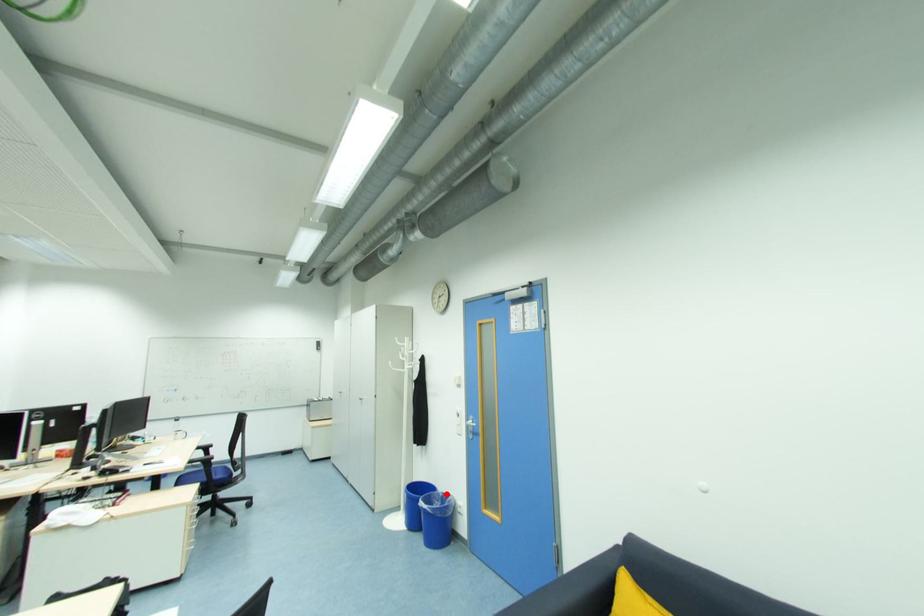
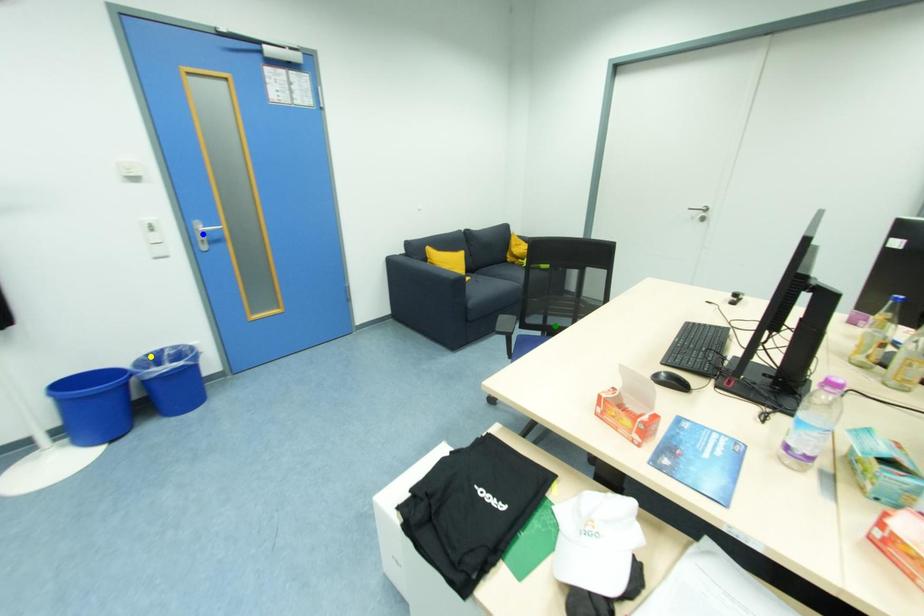
Question: I am providing you with two images of the same scene from different viewpoints. A red point is marked on the first image. You are given multiple points on the second image. Which point in image 2 is actually the same real-world point as the red point in image 1?

Choices:
 (A) blue point
 (B) green point
 (C) yellow point

Answer: (C)